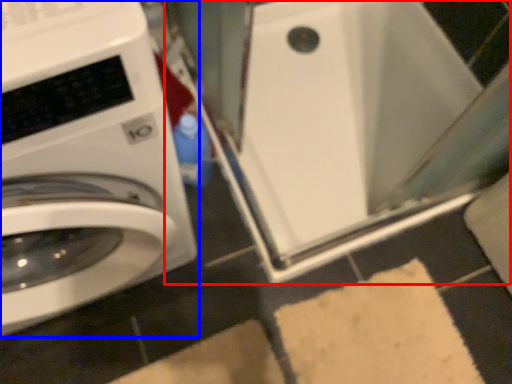
Question: Which object is further to the camera taking this photo, water heater (highlighted by a red box) or washing machine (highlighted by a blue box)?

Choices:
 (A) water heater
 (B) washing machine

Answer: (A)